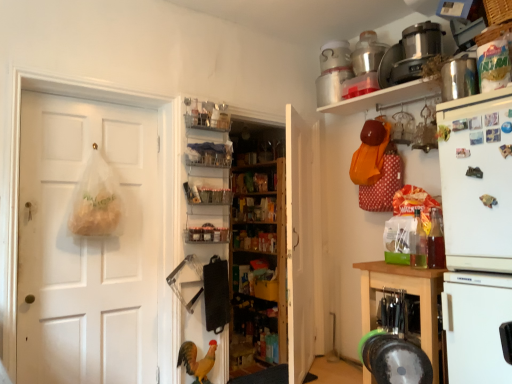
Locate an element on the screen. blank space situated above white matte door at left, the first door from the left (from a real-world perspective) is located at coordinates (92, 103).